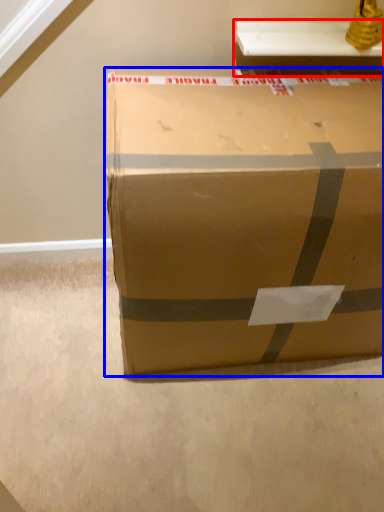
Question: Which object appears farthest to the camera in this image, table (highlighted by a red box) or box (highlighted by a blue box)?

Choices:
 (A) table
 (B) box

Answer: (A)